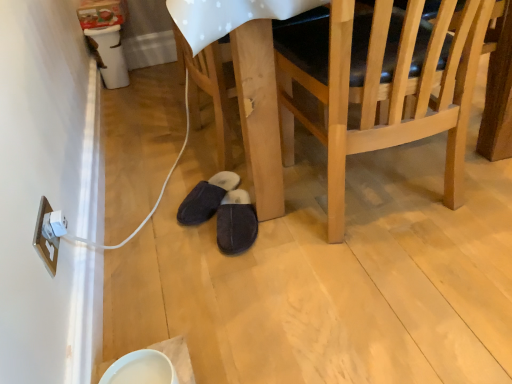
Question: Is white plastic electric outlet at lower left in front of or behind light wood chair at center in the image?

Choices:
 (A) behind
 (B) front

Answer: (A)

Question: Is point (39, 238) closer or farther from the camera than point (330, 175)?

Choices:
 (A) farther
 (B) closer

Answer: (B)

Question: Which of these objects is positioned farthest from the light wood chair at center?

Choices:
 (A) dark gray suede slippers at lower center, the 1th footwear from the right
 (B) black suede slippers at lower center, the first footwear viewed from the left
 (C) white plastic electric outlet at lower left

Answer: (C)

Question: Considering the real-world distances, which object is closest to the light wood chair at center?

Choices:
 (A) black suede slippers at lower center, the 2th footwear positioned from the right
 (B) dark gray suede slippers at lower center, placed as the 2th footwear when sorted from left to right
 (C) white plastic electric outlet at lower left

Answer: (B)